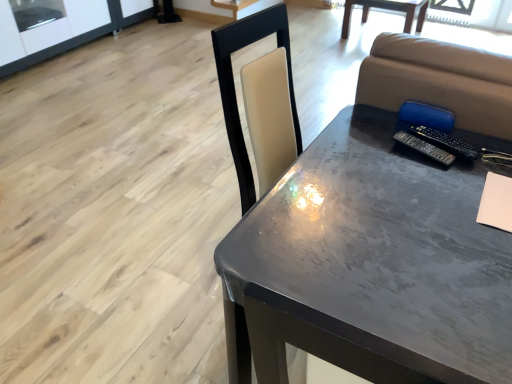
Where is `vacant space to the left of black plastic remote at right, which appears as the first remote when viewed from the left`? This screenshot has width=512, height=384. vacant space to the left of black plastic remote at right, which appears as the first remote when viewed from the left is located at coordinates (367, 157).